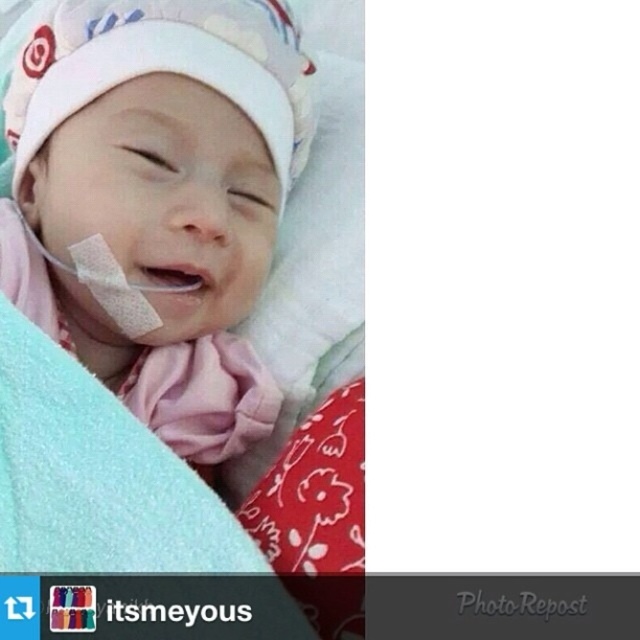
Is white soft hat at upper center to the left of light blue soft blanket at center from the viewer's perspective?

Incorrect, white soft hat at upper center is not on the left side of light blue soft blanket at center.

Who is positioned more to the right, white soft hat at upper center or light blue soft blanket at center?

white soft hat at upper center is more to the right.

Is point (115, 253) farther from camera compared to point (88, 508)?

Yes, point (115, 253) is farther from viewer.

Where is `white soft hat at upper center`? white soft hat at upper center is located at coordinates (156, 198).

Is light blue soft blanket at center to the right of white adhesive bandage at center from the viewer's perspective?

Correct, you'll find light blue soft blanket at center to the right of white adhesive bandage at center.

Where is `light blue soft blanket at center`? light blue soft blanket at center is located at coordinates (96, 476).

Where is `light blue soft blanket at center`? light blue soft blanket at center is located at coordinates (96, 476).

Between point (141, 268) and point (106, 301), which one is positioned behind?

The point (106, 301) is behind.

What do you see at coordinates (156, 198) in the screenshot? The height and width of the screenshot is (640, 640). I see `white soft hat at upper center` at bounding box center [156, 198].

Locate an element on the screen. The height and width of the screenshot is (640, 640). white soft hat at upper center is located at coordinates (156, 198).

Where is `white soft hat at upper center`? white soft hat at upper center is located at coordinates (156, 198).